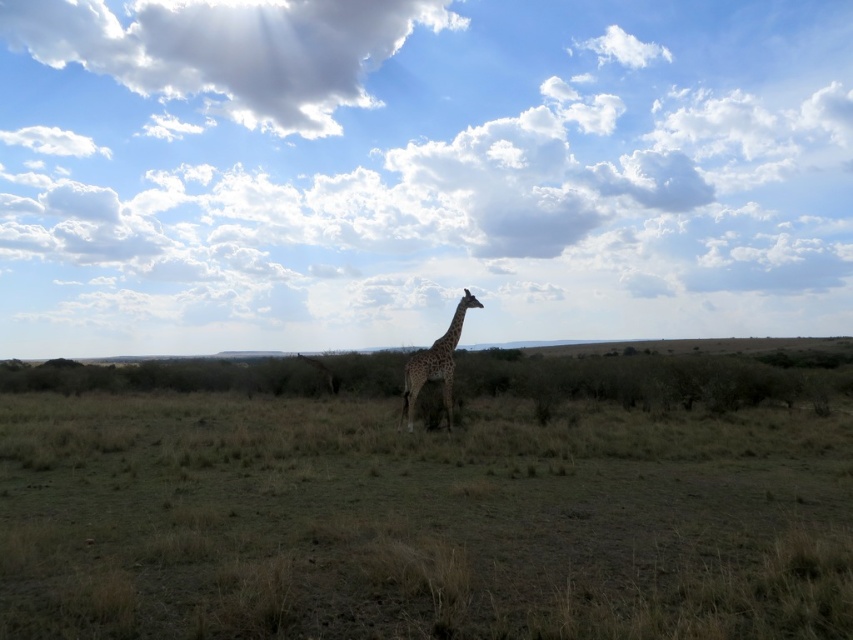
Question: Which of the following is the farthest from the observer?

Choices:
 (A) pyautogui.click(x=363, y=84)
 (B) pyautogui.click(x=270, y=253)

Answer: (A)

Question: Does cloudy sky at upper center appear on the right side of giraffe at center?

Choices:
 (A) yes
 (B) no

Answer: (B)

Question: Among these points, which one is farthest from the camera?

Choices:
 (A) (279, 45)
 (B) (564, 163)

Answer: (A)

Question: Is cloudy sky at upper center to the left of giraffe at center from the viewer's perspective?

Choices:
 (A) no
 (B) yes

Answer: (B)

Question: Which point appears farthest from the camera in this image?

Choices:
 (A) (196, 204)
 (B) (450, 364)

Answer: (A)

Question: Is cloudy sky at upper center further to the viewer compared to giraffe at center?

Choices:
 (A) yes
 (B) no

Answer: (A)